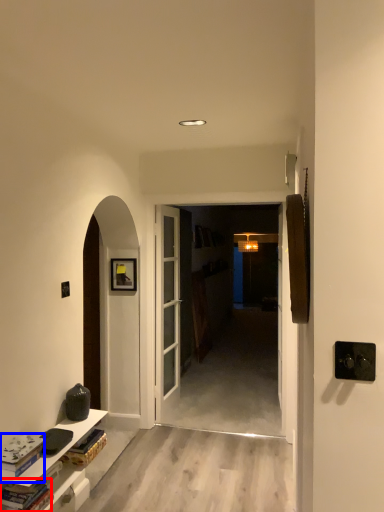
Question: Which object appears closest to the camera in this image, book (highlighted by a red box) or book (highlighted by a blue box)?

Choices:
 (A) book
 (B) book

Answer: (A)